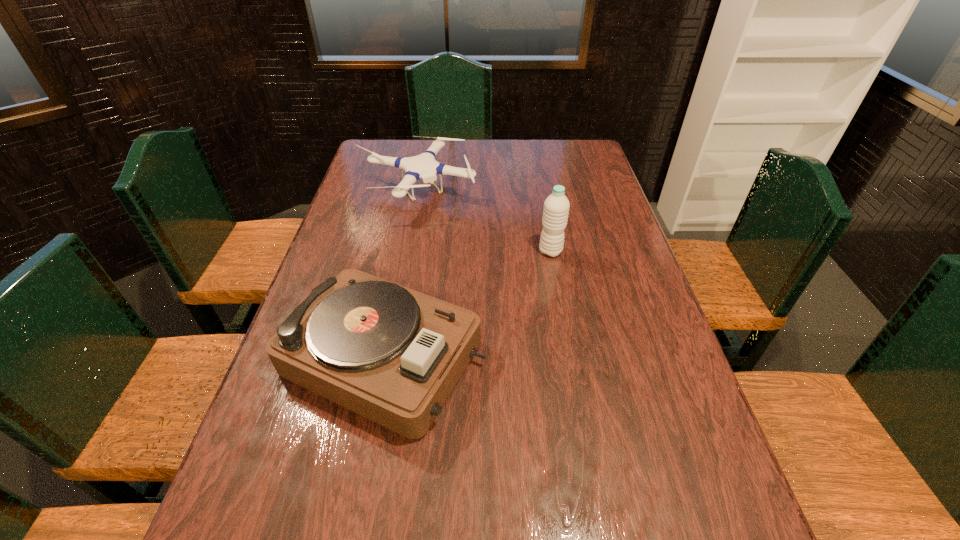
What are the coordinates of `object located at the far left corner` in the screenshot? It's located at (424, 166).

What are the coordinates of `free space at the far edge` in the screenshot? It's located at (497, 148).

The width and height of the screenshot is (960, 540). In the image, there is a desktop. Find the location of `free space at the left edge`. free space at the left edge is located at coordinates (356, 184).

You are a GUI agent. You are given a task and a screenshot of the screen. Output one action in this format:
    pyautogui.click(x=<x>, y=<y>)
    Task: Click on the free region at the right edge of the desktop
    The image size is (960, 540).
    Given the screenshot: What is the action you would take?
    pyautogui.click(x=617, y=256)

Locate an element on the screen. free location at the far right corner is located at coordinates [574, 168].

Identify the location of free space between the drone and the second nearest object. Image resolution: width=960 pixels, height=540 pixels. (483, 221).

This screenshot has width=960, height=540. I want to click on vacant area between the drone and the record player, so click(400, 274).

I want to click on free space between the drone and the record player, so click(400, 274).

Locate an element on the screen. The width and height of the screenshot is (960, 540). free space that is in between the rightmost object and the nearest object is located at coordinates (468, 304).

Image resolution: width=960 pixels, height=540 pixels. In order to click on free area in between the second farthest object and the record player in this screenshot , I will do `click(468, 304)`.